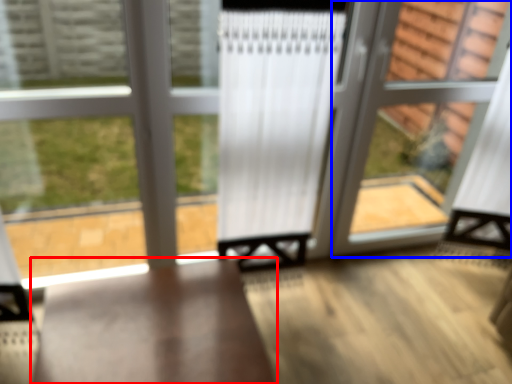
Question: Which of the following is the farthest to the observer, furniture (highlighted by a red box) or screen door (highlighted by a blue box)?

Choices:
 (A) furniture
 (B) screen door

Answer: (B)